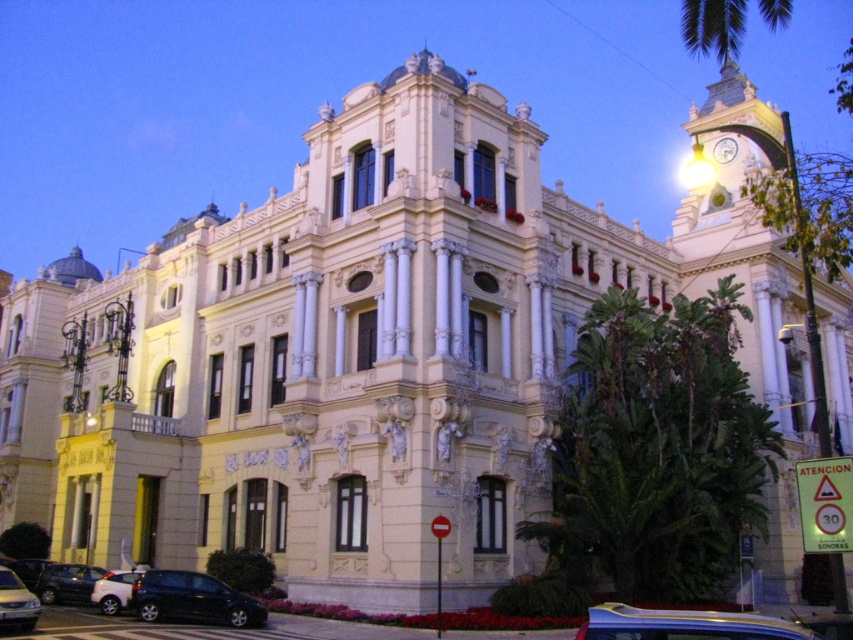
Question: Can you confirm if dark gray metallic car at lower left is wider than metallic silver car at lower left?

Choices:
 (A) no
 (B) yes

Answer: (B)

Question: Does metallic blue car at lower center appear on the left side of metallic silver car at lower left?

Choices:
 (A) yes
 (B) no

Answer: (B)

Question: Which object is positioned farthest from the white matte car at lower left?

Choices:
 (A) metallic blue car at lower center
 (B) metallic silver car at lower left

Answer: (A)

Question: Among these objects, which one is farthest from the camera?

Choices:
 (A) metallic clock at upper right
 (B) dark gray metallic car at lower left

Answer: (A)

Question: Which object appears closest to the camera in this image?

Choices:
 (A) metallic silver car at lower left
 (B) dark gray metallic car at lower left

Answer: (A)

Question: Is the position of shiny black hatchback at lower left more distant than that of metallic silver car at lower left?

Choices:
 (A) no
 (B) yes

Answer: (B)